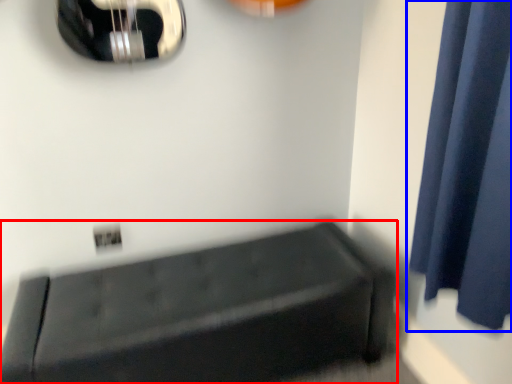
Question: Which point is further to the camera, furniture (highlighted by a red box) or curtain (highlighted by a blue box)?

Choices:
 (A) furniture
 (B) curtain

Answer: (A)